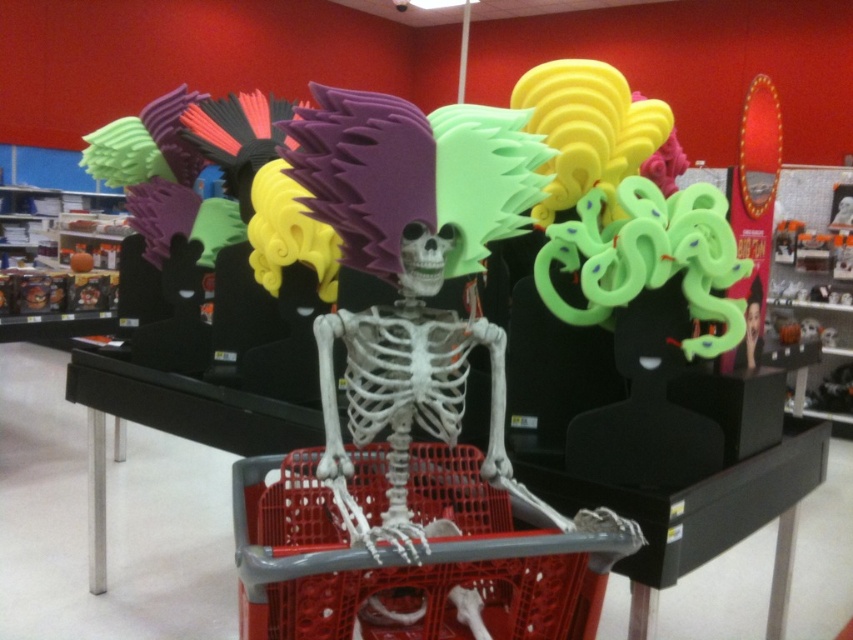
Is red plastic shopping basket at center to the right of smooth plastic skeleton at center from the viewer's perspective?

In fact, red plastic shopping basket at center is to the left of smooth plastic skeleton at center.

The width and height of the screenshot is (853, 640). In order to click on red plastic shopping basket at center in this screenshot , I will do `click(401, 557)`.

Where is `red plastic shopping basket at center`? The height and width of the screenshot is (640, 853). red plastic shopping basket at center is located at coordinates (401, 557).

This screenshot has height=640, width=853. I want to click on red plastic shopping basket at center, so click(x=401, y=557).